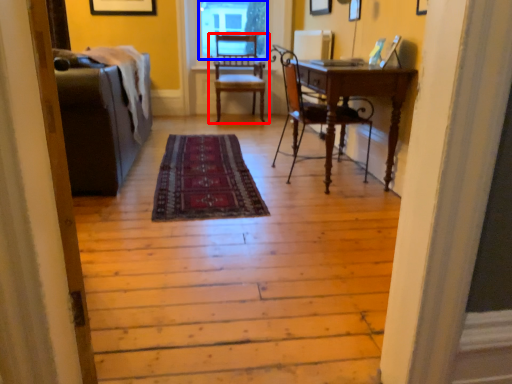
Question: Which of the following is the farthest to the observer, chair (highlighted by a red box) or window screen (highlighted by a blue box)?

Choices:
 (A) chair
 (B) window screen

Answer: (B)